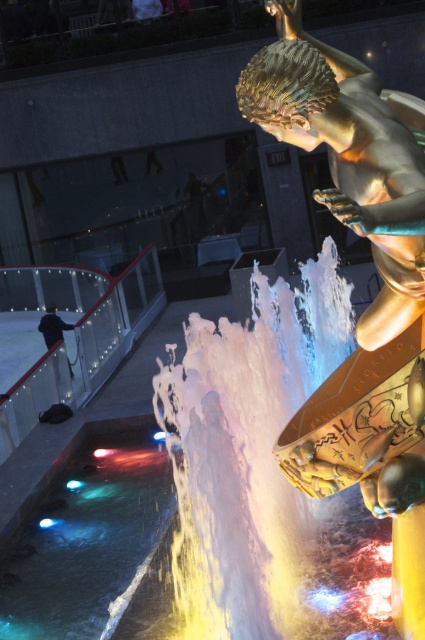
Between point (421, 276) and point (50, 305), which one is positioned behind?

The point (50, 305) is behind.

Between point (269, 45) and point (53, 330), which one is positioned behind?

Point (53, 330)

Identify the location of gold metallic statue at center. The height and width of the screenshot is (640, 425). (348, 156).

Between gold metallic statue at center and translucent glass water at lower left, which one has less height?

translucent glass water at lower left

Describe the element at coordinates (348, 156) in the screenshot. I see `gold metallic statue at center` at that location.

The width and height of the screenshot is (425, 640). In order to click on gold metallic statue at center in this screenshot , I will do 348,156.

Between point (62, 490) and point (50, 320), which one is positioned behind?

Point (50, 320)

Is translucent glass water at lower left positioned in front of dark blue fabric jacket at left?

Yes, it is.

Between point (119, 468) and point (48, 333), which one is positioned in front?

Positioned in front is point (119, 468).

At what (x,y) coordinates should I click in order to perform the action: click on translucent glass water at lower left. Please return your answer as a coordinate pair (x, y). Looking at the image, I should click on (88, 538).